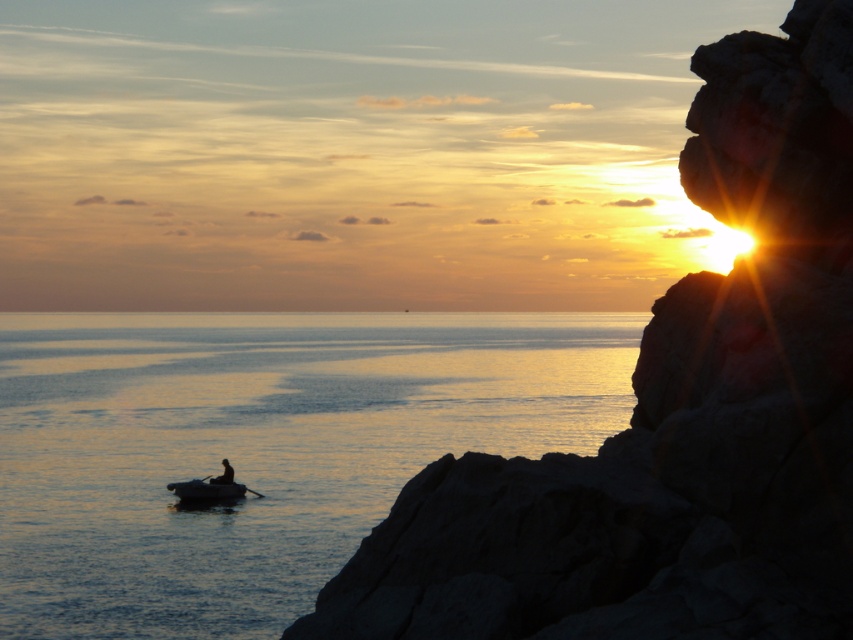
Can you confirm if rugged stone cliff at right is shorter than dark gray rubber boat at center-left?

Incorrect, rugged stone cliff at right's height does not fall short of dark gray rubber boat at center-left's.

Which is above, rugged stone cliff at right or dark gray rubber boat at center-left?

rugged stone cliff at right is higher up.

Does point (746, 49) come closer to viewer compared to point (241, 484)?

Yes, point (746, 49) is in front of point (241, 484).

Find the location of a particular element. This screenshot has width=853, height=640. rugged stone cliff at right is located at coordinates (675, 416).

Can you confirm if rugged stone cliff at right is smaller than silhouette wooden boat at lower left?

No, rugged stone cliff at right is not smaller than silhouette wooden boat at lower left.

Locate an element on the screen. rugged stone cliff at right is located at coordinates (675, 416).

Locate an element on the screen. The height and width of the screenshot is (640, 853). rugged stone cliff at right is located at coordinates (675, 416).

This screenshot has width=853, height=640. What are the coordinates of `rugged stone cliff at right` in the screenshot? It's located at (675, 416).